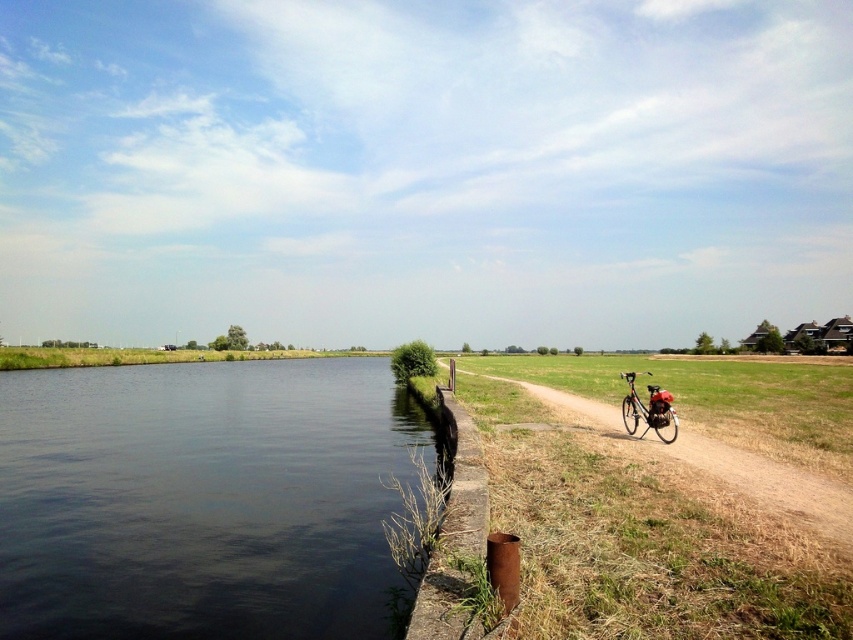
Is brown dirt path at right shorter than shiny metallic bicycle at right?

Yes, brown dirt path at right is shorter than shiny metallic bicycle at right.

Is point (531, 394) in front of point (659, 406)?

No, (531, 394) is further to viewer.

The width and height of the screenshot is (853, 640). Find the location of `brown dirt path at right`. brown dirt path at right is located at coordinates (769, 483).

Can you confirm if dark water at center is positioned to the right of brown dirt path at right?

No, dark water at center is not to the right of brown dirt path at right.

At what (x,y) coordinates should I click in order to perform the action: click on dark water at center. Please return your answer as a coordinate pair (x, y). The image size is (853, 640). Looking at the image, I should click on [202, 499].

Does point (323, 568) lie behind point (759, 461)?

No, it is in front of (759, 461).

The width and height of the screenshot is (853, 640). Identify the location of dark water at center. (202, 499).

From the picture: Can you confirm if dark water at center is positioned above shiny metallic bicycle at right?

Actually, dark water at center is below shiny metallic bicycle at right.

Is point (165, 497) closer to viewer compared to point (675, 419)?

That is False.

Identify the location of dark water at center. Image resolution: width=853 pixels, height=640 pixels. (202, 499).